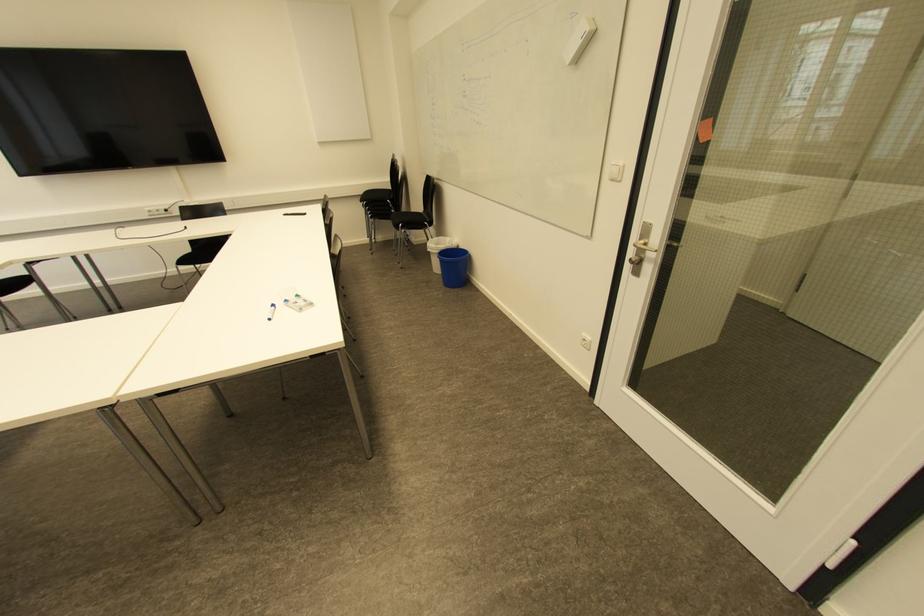
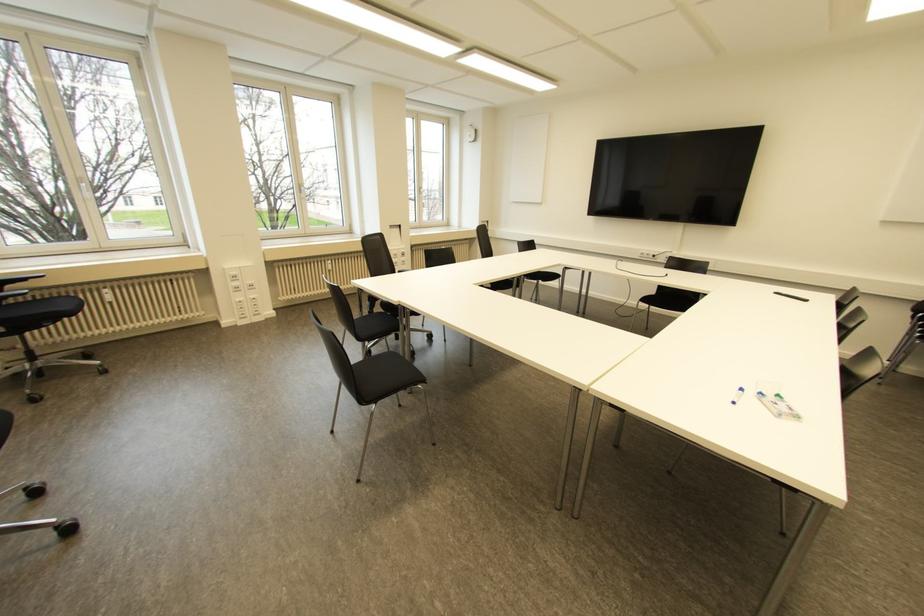
In the second image, find the point that corresponds to point 273,306 in the first image.

(739, 390)